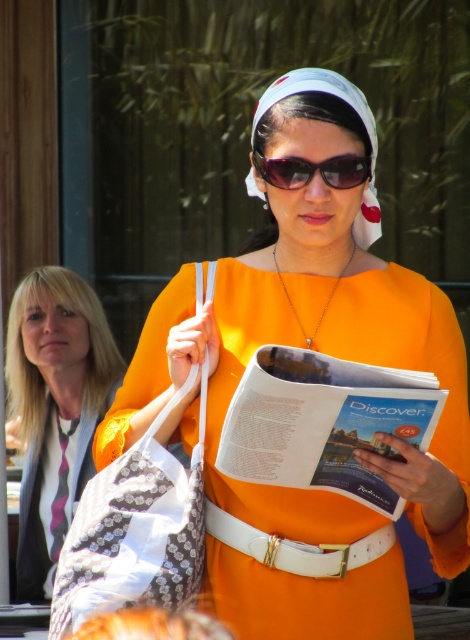
You are organizing a small event and need to know which item is larger between the patterned fabric bag at center and the white leather belt at center. Can you determine which one is bigger?

The patterned fabric bag at center is bigger than the white leather belt at center according to the description.

You are a photographer trying to capture the person in the foreground. You want to focus on the patterned fabric bag at center and the white leather belt at center. Which object should you zoom in on first to ensure it appears larger in your photo?

The patterned fabric bag at center is closer to the viewer than the white leather belt at center, so you should zoom in on the patterned fabric bag at center first to ensure it appears larger in your photo.

You are a fashion designer observing the scene and want to create a new outfit that complements the orange matte dress at center and sunglasses at center. Considering their sizes, which item should you focus on to ensure the design maintains a balanced look?

The orange matte dress at center has a larger width than the sunglasses at center, so focusing on the orange matte dress at center to balance proportions would be better.